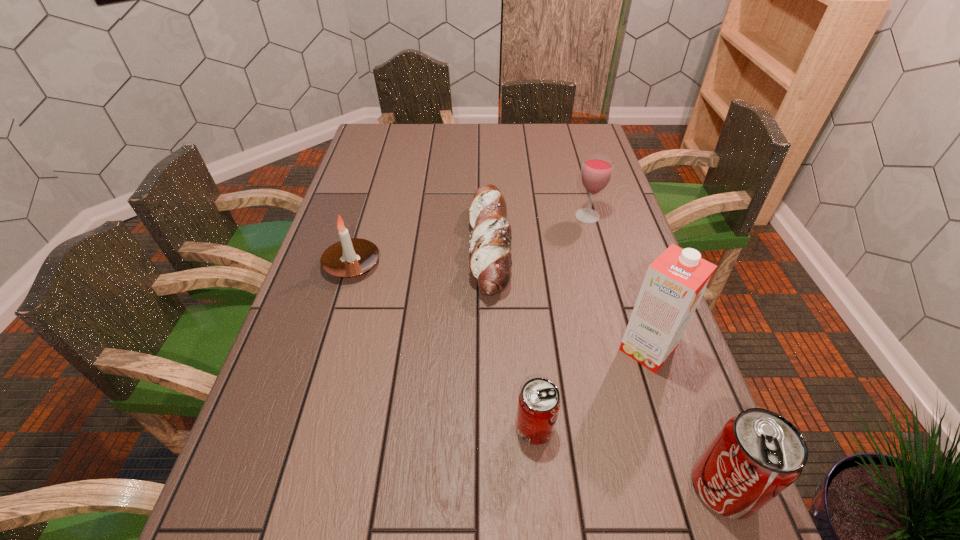
Locate an element on the screen. free space that is in between the baguet and the tallest object is located at coordinates (568, 299).

Locate an element on the screen. vacant area that lies between the leftmost object and the second nearest object is located at coordinates (444, 346).

This screenshot has width=960, height=540. In order to click on free space between the carton and the candle in this screenshot , I will do `click(499, 307)`.

Identify which object is located as the fourth nearest to the leftmost object. Please provide its 2D coordinates. Your answer should be formatted as a tuple, i.e. [(x, y)], where the tuple contains the x and y coordinates of a point satisfying the conditions above.

[(675, 282)]

Select which object appears as the fifth closest to the right pop soda. Please provide its 2D coordinates. Your answer should be formatted as a tuple, i.e. [(x, y)], where the tuple contains the x and y coordinates of a point satisfying the conditions above.

[(350, 257)]

Find the location of a particular element. The height and width of the screenshot is (540, 960). vacant space that satisfies the following two spatial constraints: 1. on the back side of the shortest object; 2. on the left side of the wineglass is located at coordinates (490, 217).